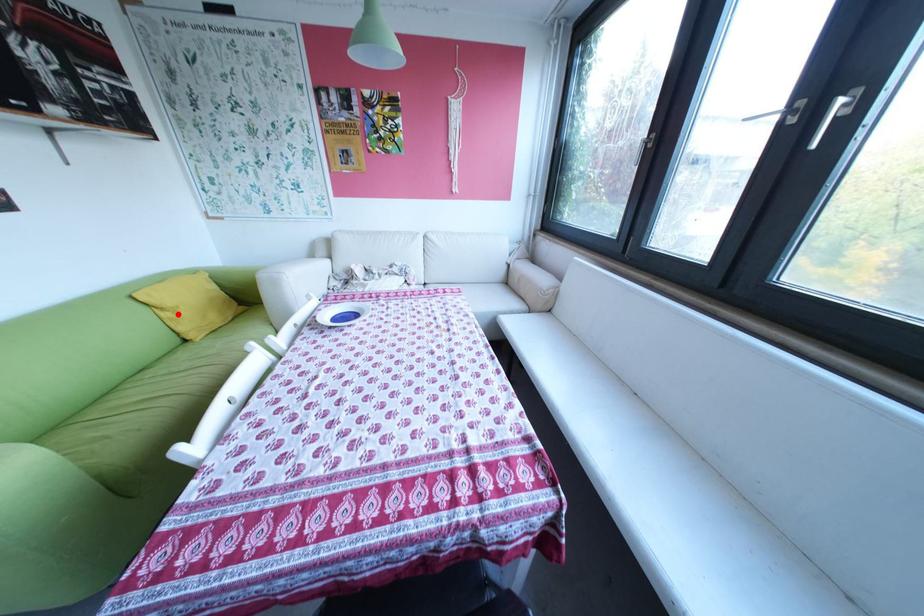
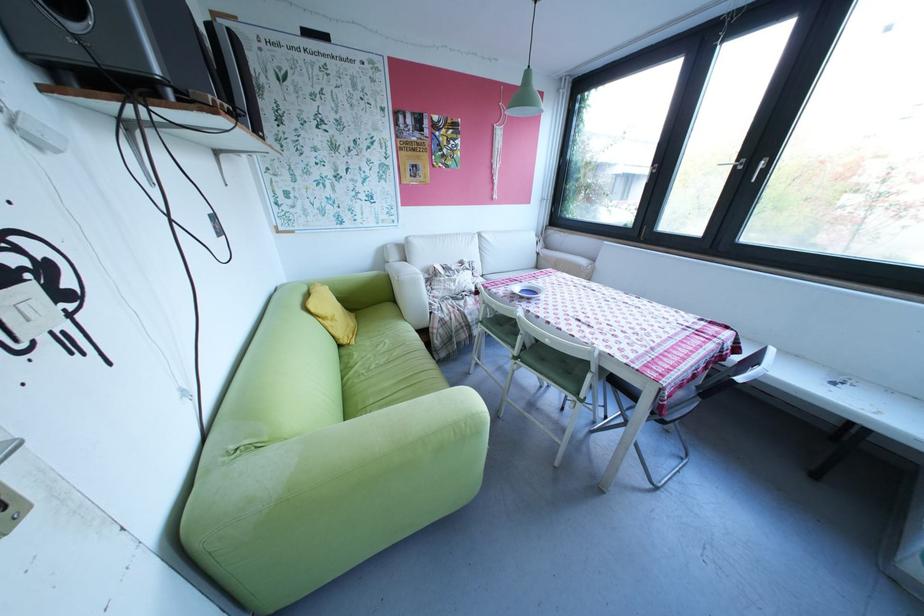
In the second image, find the point that corresponds to the highlighted location in the first image.

(339, 323)